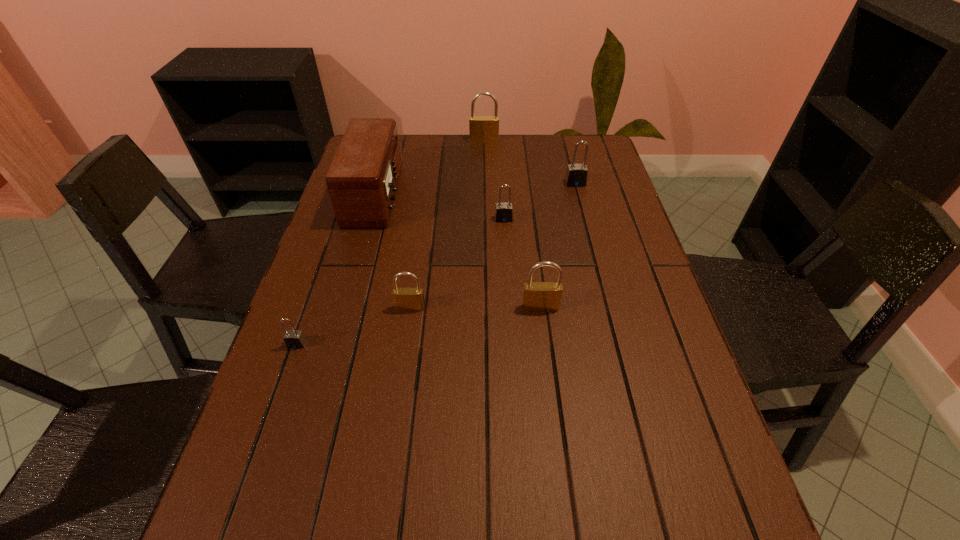
Locate an element on the screen. The height and width of the screenshot is (540, 960). the tallest padlock is located at coordinates (483, 129).

I want to click on the biggest brass padlock, so click(x=483, y=129).

Image resolution: width=960 pixels, height=540 pixels. What are the coordinates of `radio receiver` in the screenshot? It's located at (362, 180).

At what (x,y) coordinates should I click in order to perform the action: click on the biggest gray padlock. Please return your answer as a coordinate pair (x, y). The height and width of the screenshot is (540, 960). Looking at the image, I should click on (576, 175).

The width and height of the screenshot is (960, 540). In order to click on the rightmost object in this screenshot , I will do `click(576, 175)`.

Identify the location of the second object from right to left. (537, 296).

In order to click on the second smallest brass padlock in this screenshot , I will do `click(537, 296)`.

You are a GUI agent. You are given a task and a screenshot of the screen. Output one action in this format:
    pyautogui.click(x=<x>, y=<y>)
    Task: Click on the second gray padlock from left to right
    
    Given the screenshot: What is the action you would take?
    pyautogui.click(x=504, y=211)

The image size is (960, 540). In order to click on the fourth nearest padlock in this screenshot , I will do `click(504, 211)`.

This screenshot has width=960, height=540. I want to click on the second padlock from left to right, so click(405, 299).